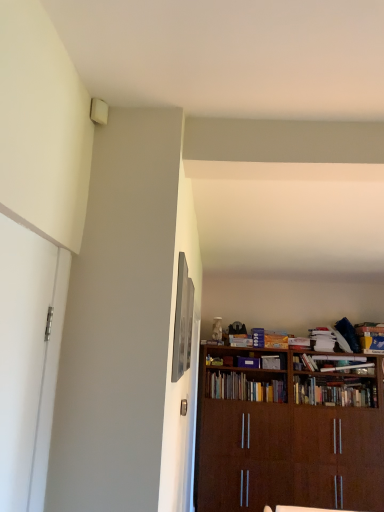
Question: In the image, is blue cardboard book at right, which is the 1th book in right-to-left order, on the left side or the right side of hardcover books at center, which appears as the fourth book when viewed from the right?

Choices:
 (A) left
 (B) right

Answer: (B)

Question: Is point (377, 330) closer or farther from the camera than point (213, 379)?

Choices:
 (A) farther
 (B) closer

Answer: (A)

Question: Estimate the real-world distances between objects in this image. Which object is closer to the hardcover book at center, positioned as the second book in right-to-left order?

Choices:
 (A) wooden bookshelf at center, the 3th book from the right
 (B) brown wooden bookcase at lower right
 (C) hardcover books at center, which appears as the fourth book when viewed from the right
 (D) blue cardboard book at right, which is the 1th book in right-to-left order
 (E) matte silver picture frame at upper center

Answer: (A)

Question: Based on their relative distances, which object is nearer to the blue cardboard book at right, arranged as the fourth book when viewed from the left?

Choices:
 (A) hardcover books at center, which appears as the fourth book when viewed from the right
 (B) matte silver picture frame at upper center
 (C) brown wooden bookcase at lower right
 (D) wooden bookshelf at center, the 3th book from the right
 (E) hardcover book at center, which is counted as the third book, starting from the left

Answer: (E)